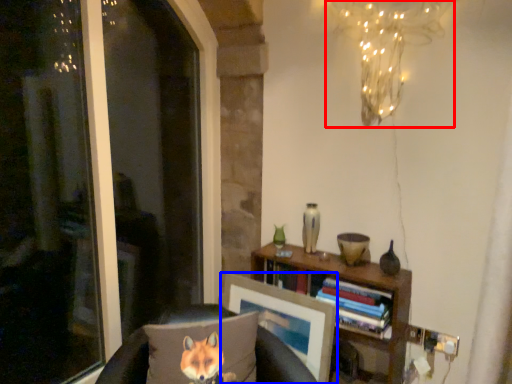
Question: Which point is closer to the camera, lamp (highlighted by a red box) or picture frame (highlighted by a blue box)?

Choices:
 (A) lamp
 (B) picture frame

Answer: (A)